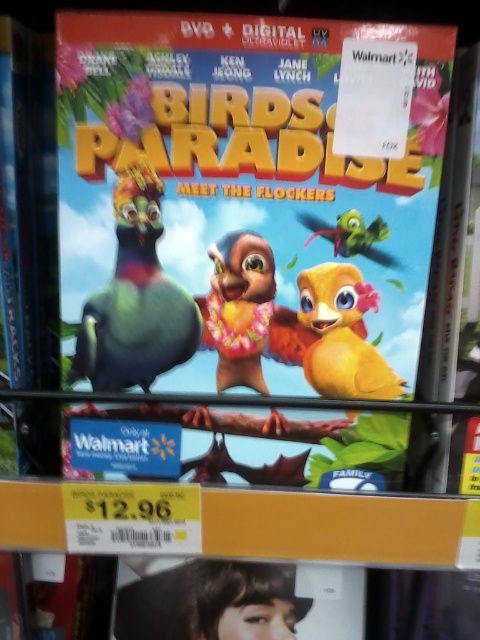
Between matte green bird at center and yellow matte bird at center, which one is positioned lower?

yellow matte bird at center

Can you confirm if matte green bird at center is positioned below yellow matte bird at center?

No, matte green bird at center is not below yellow matte bird at center.

The image size is (480, 640). Find the location of `matte green bird at center`. matte green bird at center is located at coordinates (134, 300).

Image resolution: width=480 pixels, height=640 pixels. Identify the location of matte green bird at center. (134, 300).

Between matte green bird at center and green matte bird at upper center, which one is positioned higher?

green matte bird at upper center is higher up.

Is matte green bird at center to the left of green matte bird at upper center from the viewer's perspective?

Yes, matte green bird at center is to the left of green matte bird at upper center.

Which is in front, point (147, 248) or point (369, 241)?

Point (369, 241)

You are a GUI agent. You are given a task and a screenshot of the screen. Output one action in this format:
    pyautogui.click(x=<x>, y=<y>)
    Task: Click on the matte green bird at center
    
    Given the screenshot: What is the action you would take?
    pyautogui.click(x=134, y=300)

Based on the photo, how distant is yellow matte bird at center from green matte bird at upper center?

yellow matte bird at center and green matte bird at upper center are 2.79 inches apart from each other.

Between point (344, 321) and point (298, 220), which one is positioned in front?

Positioned in front is point (298, 220).

Where is `yellow matte bird at center`? Image resolution: width=480 pixels, height=640 pixels. yellow matte bird at center is located at coordinates (342, 336).